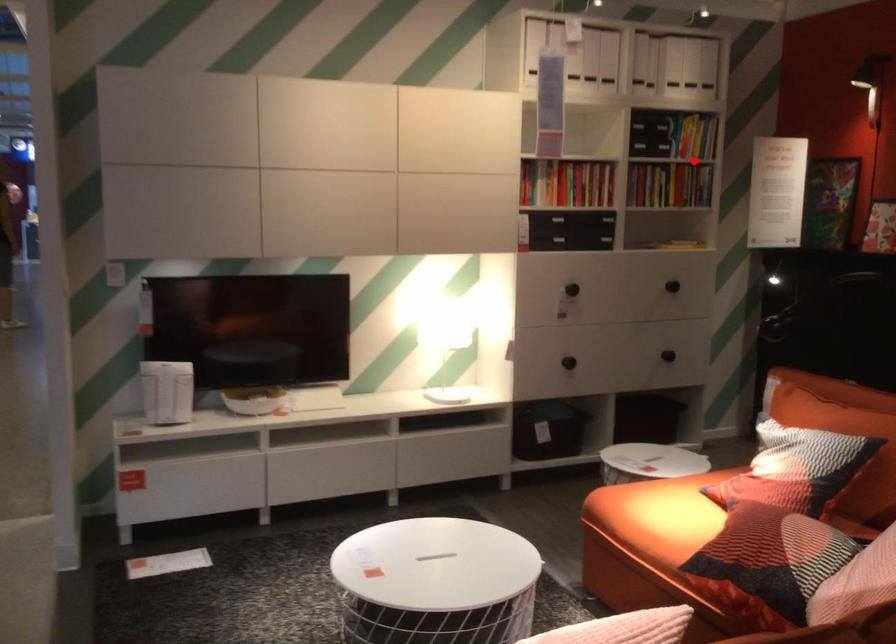
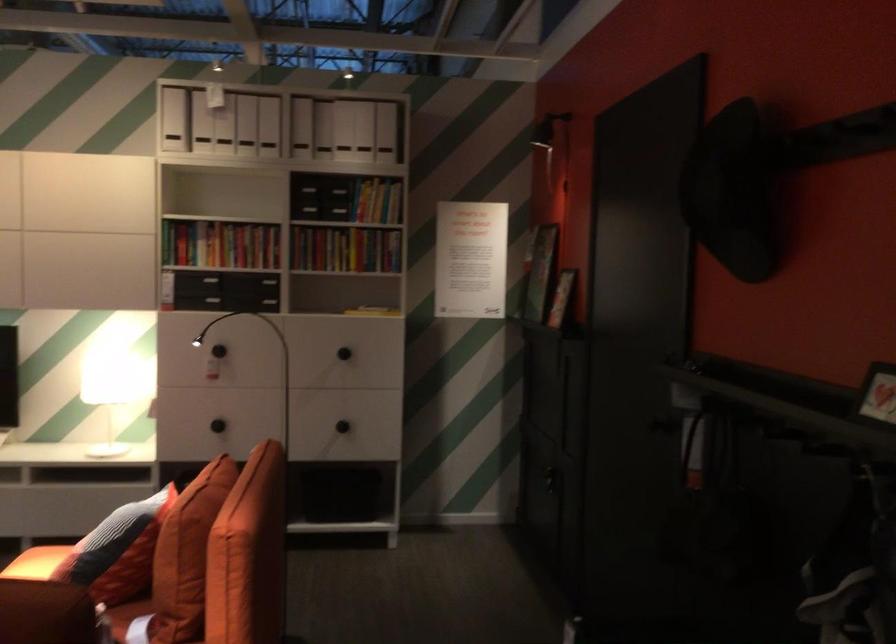
Question: I am providing you with two images of the same scene from different viewpoints. A red point is marked on the first image. Is the red point's position out of view in image 2?

Choices:
 (A) Yes
 (B) No

Answer: (B)